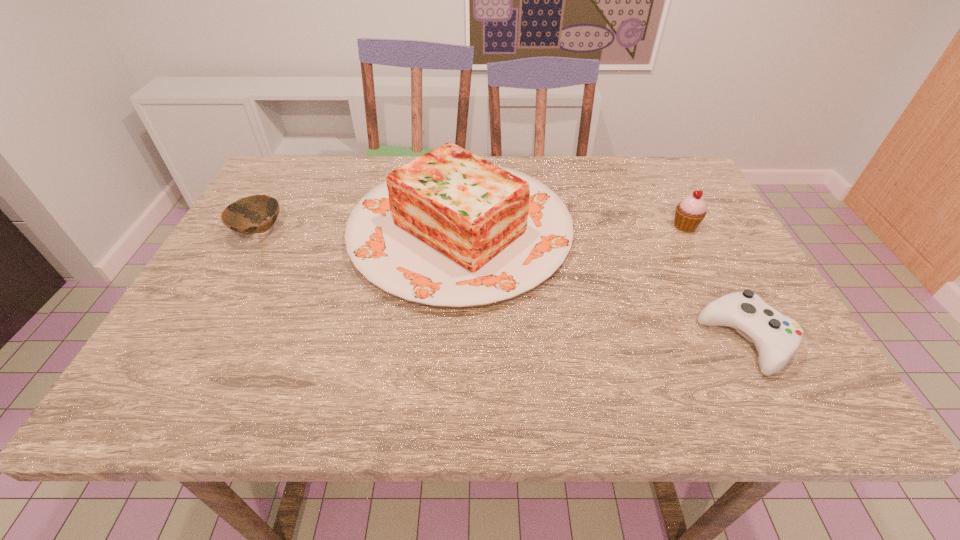
This screenshot has width=960, height=540. I want to click on vacant space at the near right corner of the desktop, so click(x=781, y=384).

I want to click on free space that is in between the control and the cupcake, so click(x=715, y=283).

Locate an element on the screen. This screenshot has width=960, height=540. vacant point located between the lasagna and the control is located at coordinates (603, 285).

This screenshot has width=960, height=540. Find the location of `free space between the control and the lasagna`. free space between the control and the lasagna is located at coordinates (603, 285).

This screenshot has height=540, width=960. In order to click on free space between the second object from left to right and the control in this screenshot , I will do `click(603, 285)`.

Identify which object is the third nearest to the leftmost object. Please provide its 2D coordinates. Your answer should be formatted as a tuple, i.e. [(x, y)], where the tuple contains the x and y coordinates of a point satisfying the conditions above.

[(689, 213)]

Point out which object is positioned as the third nearest to the third shortest object. Please provide its 2D coordinates. Your answer should be formatted as a tuple, i.e. [(x, y)], where the tuple contains the x and y coordinates of a point satisfying the conditions above.

[(243, 216)]

Identify the location of blank space that satisfies the following two spatial constraints: 1. on the back side of the bowl; 2. on the right side of the cupcake. tap(263, 226).

Identify the location of free space that satisfies the following two spatial constraints: 1. on the front side of the cupcake; 2. on the left side of the control. Image resolution: width=960 pixels, height=540 pixels. (745, 340).

Locate an element on the screen. The image size is (960, 540). free spot that satisfies the following two spatial constraints: 1. on the back side of the cupcake; 2. on the left side of the bowl is located at coordinates (263, 226).